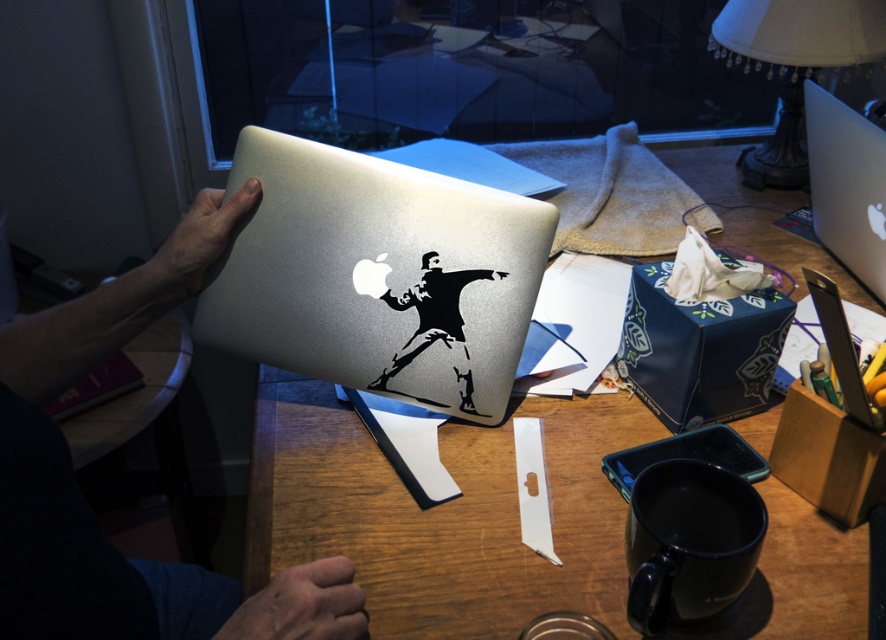
You are organizing a desk and need to place both the satin silver laptop at center and the white fabric lampshade at upper right. Based on their sizes, which object requires more vertical space?

The satin silver laptop at center requires more vertical space because it is taller than the white fabric lampshade at upper right.

You are organizing your desk and want to place the metallic silver laptop at upper center and the satin silver laptop at upper right in a straight line from left to right. Based on their current positions, which laptop should you move to the right to achieve this alignment?

The metallic silver laptop at upper center is already positioned on the left side of the satin silver laptop at upper right, so they are already aligned in a straight line from left to right. No movement is needed.

Looking at this image, you are organizing a desk and need to place both the metallic silver laptop at upper center and the satin silver laptop at upper right. Which one requires more desk space due to its size?

The metallic silver laptop at upper center requires more desk space because it is bigger than the satin silver laptop at upper right.